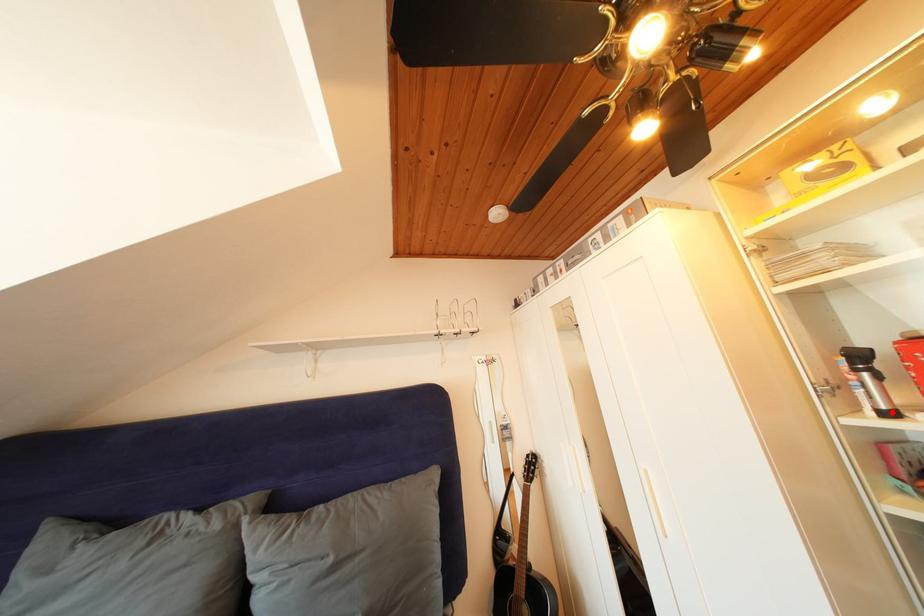
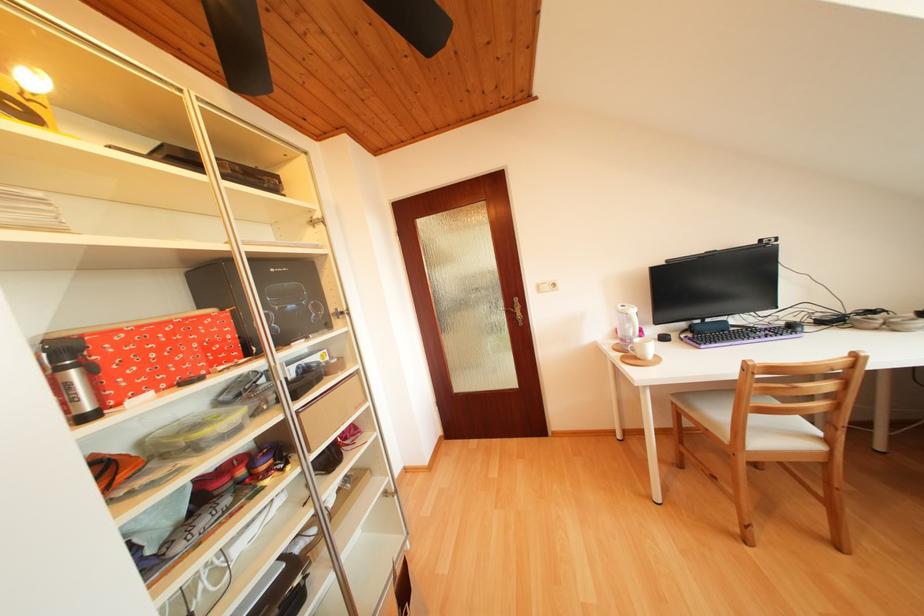
Find the pixel in the second image that matches the highlighted location in the first image.

(96, 414)